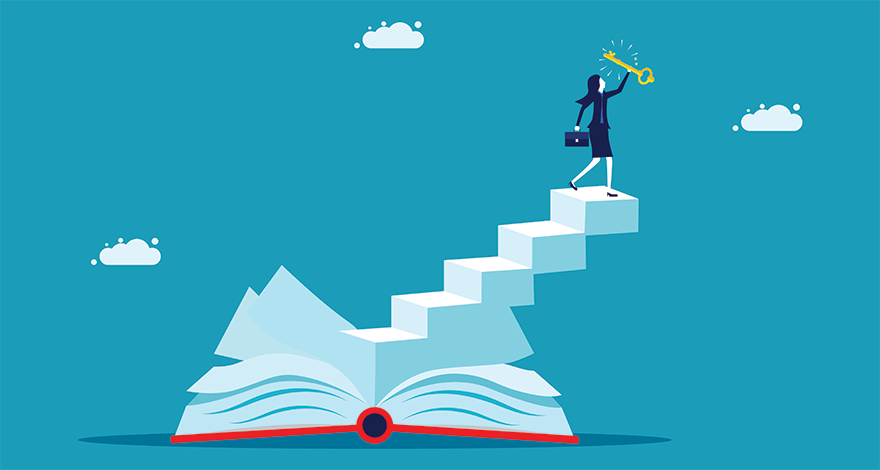
Where is `stairsteps`? This screenshot has height=470, width=880. stairsteps is located at coordinates (390, 335), (429, 302), (484, 263), (536, 229), (588, 196).